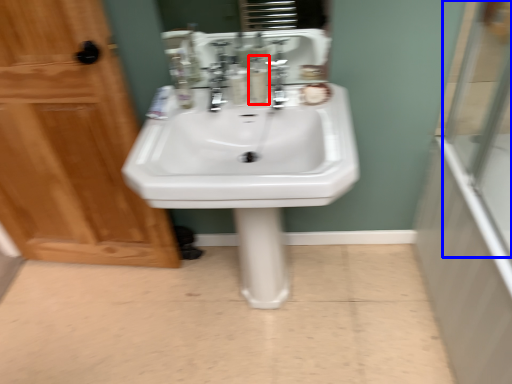
Question: Among these objects, which one is nearest to the camera, mouthwash (highlighted by a red box) or glass door (highlighted by a blue box)?

Choices:
 (A) mouthwash
 (B) glass door

Answer: (B)